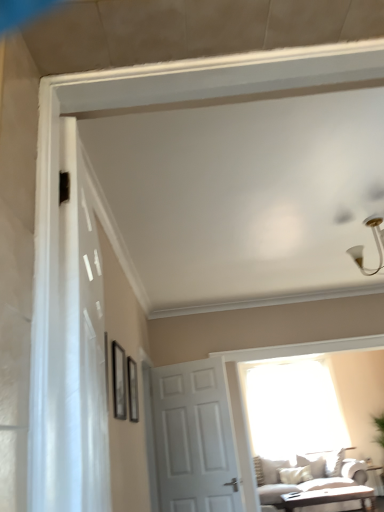
Question: Does white sheer curtain at left lie in front of transparent glass window at center?

Choices:
 (A) yes
 (B) no

Answer: (A)

Question: Is white sheer curtain at left directly adjacent to transparent glass window at center?

Choices:
 (A) no
 (B) yes

Answer: (A)

Question: Is white sheer curtain at left at the right side of transparent glass window at center?

Choices:
 (A) no
 (B) yes

Answer: (A)

Question: Does white sheer curtain at left come behind transparent glass window at center?

Choices:
 (A) yes
 (B) no

Answer: (B)

Question: Is white sheer curtain at left completely or partially outside of transparent glass window at center?

Choices:
 (A) yes
 (B) no

Answer: (A)

Question: Based on their sizes in the image, would you say white sheer curtain at left is bigger or smaller than white glossy table at lower right, the first table positioned from the right?

Choices:
 (A) big
 (B) small

Answer: (A)

Question: From a real-world perspective, relative to white glossy table at lower right, the first table positioned from the right, is white sheer curtain at left vertically above or below?

Choices:
 (A) below
 (B) above

Answer: (B)

Question: Is white sheer curtain at left inside the boundaries of white glossy table at lower right, placed as the 2th table when sorted from front to back, or outside?

Choices:
 (A) outside
 (B) inside

Answer: (A)

Question: Is white sheer curtain at left wider or thinner than white glossy table at lower right, which is the 1th table in back-to-front order?

Choices:
 (A) thin
 (B) wide

Answer: (A)

Question: In the image, is white glossy light fixture at upper right positioned in front of or behind white matte door at center?

Choices:
 (A) behind
 (B) front

Answer: (B)

Question: Looking at their shapes, would you say white glossy light fixture at upper right is wider or thinner than white matte door at center?

Choices:
 (A) wide
 (B) thin

Answer: (A)

Question: From a real-world perspective, is white glossy light fixture at upper right above or below white matte door at center?

Choices:
 (A) above
 (B) below

Answer: (A)

Question: Is white glossy light fixture at upper right situated inside white matte door at center or outside?

Choices:
 (A) outside
 (B) inside

Answer: (A)

Question: From the image's perspective, is light brown wooden coffee table at lower right, the 1th table when ordered from left to right, located above or below white glossy light fixture at upper right?

Choices:
 (A) above
 (B) below

Answer: (B)

Question: Does point (355, 485) appear closer or farther from the camera than point (365, 274)?

Choices:
 (A) farther
 (B) closer

Answer: (A)